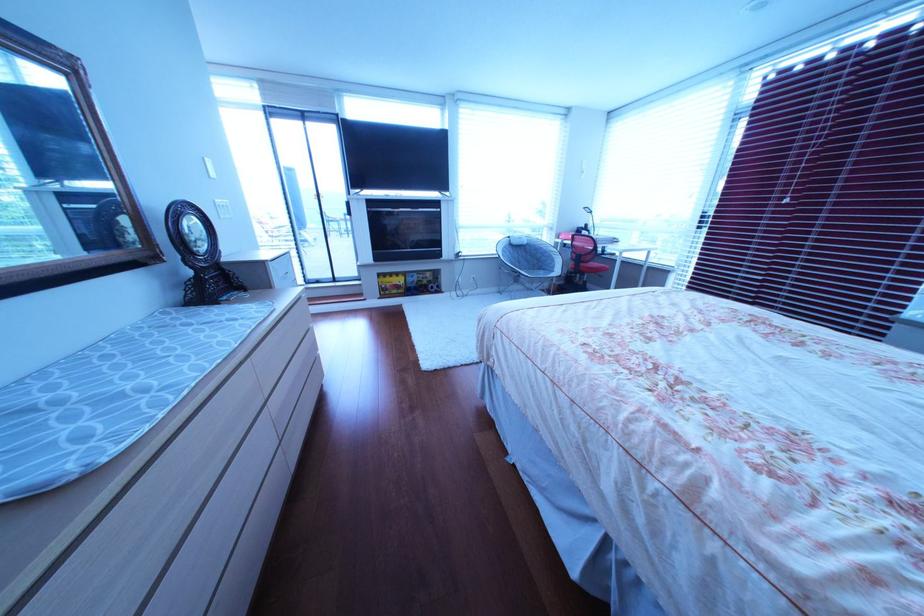
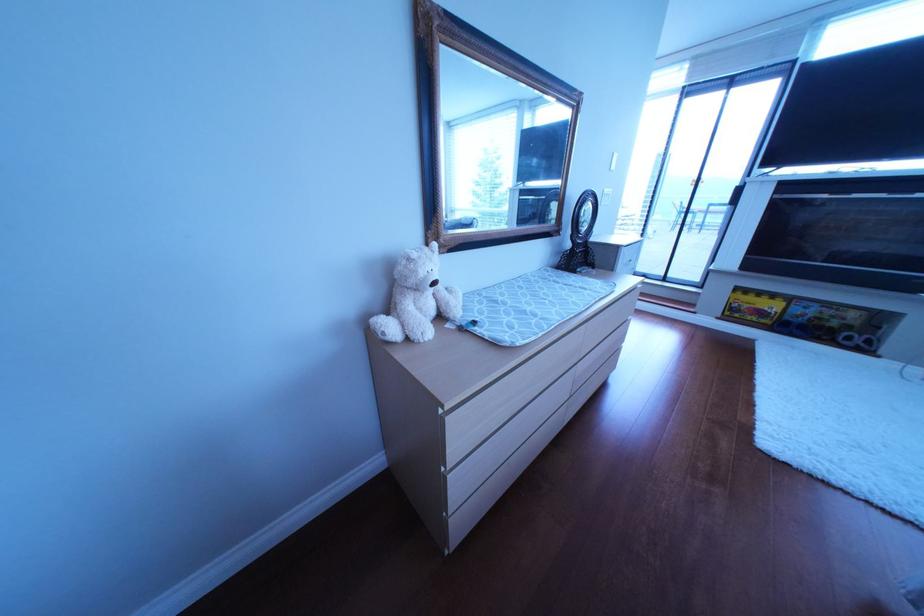
Locate, in the second image, the point that corresponds to [165,256] in the first image.

(573, 230)